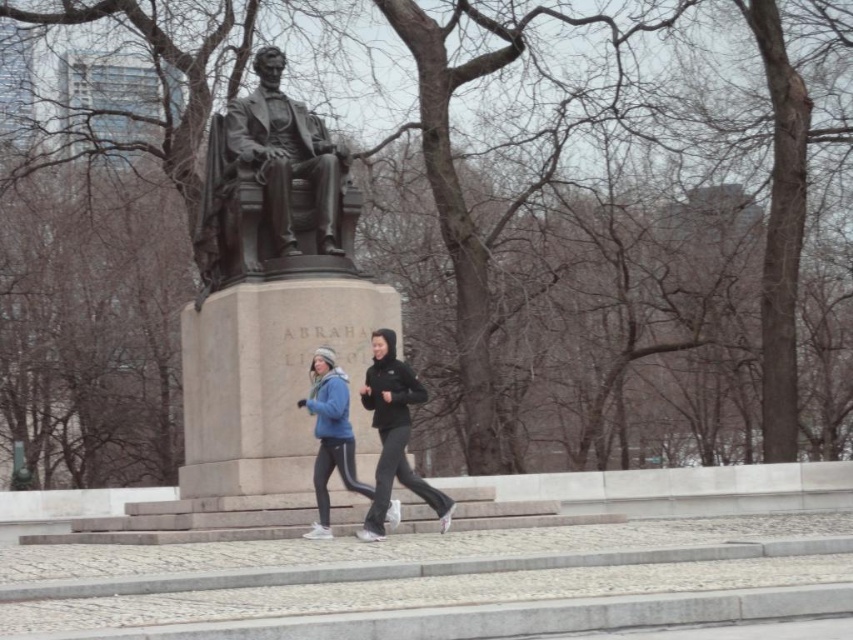
You are a photographer trying to capture a photo of the bronze statue at center without the matte blue jacket at center appearing in the frame. Based on their relative widths, is this possible?

The bronze statue at center might be wider than the matte blue jacket at center, so it may be challenging to frame the statue without including the jacket if they are positioned closely together. Adjusting your angle or moving further back could help isolate the statue.

You are standing in the park and want to take a photo of the statue of Abraham Lincoln. You notice two points in the scene at coordinates point (326, 221) and point (387, 342). Which point is closer to your camera position?

Point (326, 221) is further to the camera than point (387, 342), so the point closer to the camera is point (387, 342).